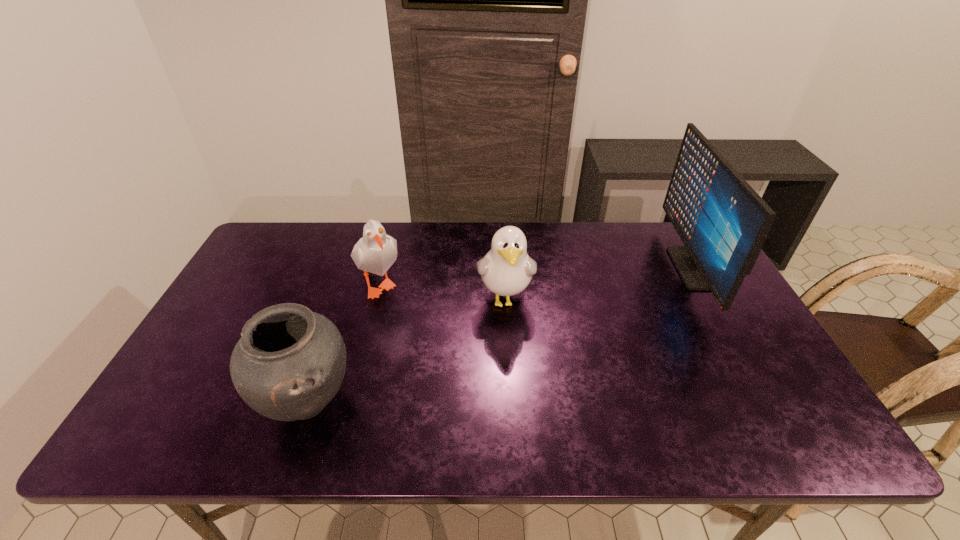
What are the coordinates of `blank space located 0.350m on the right of the urn` in the screenshot? It's located at click(509, 402).

Locate an element on the screen. The image size is (960, 540). computer monitor at the far edge is located at coordinates (722, 221).

Image resolution: width=960 pixels, height=540 pixels. Find the location of `gull located in the far edge section of the desktop`. gull located in the far edge section of the desktop is located at coordinates (375, 252).

At what (x,y) coordinates should I click in order to perform the action: click on object situated at the near edge. Please return your answer as a coordinate pair (x, y). This screenshot has width=960, height=540. Looking at the image, I should click on (290, 362).

This screenshot has height=540, width=960. In order to click on object that is at the right edge in this screenshot , I will do `click(722, 221)`.

Locate an element on the screen. Image resolution: width=960 pixels, height=540 pixels. object present at the far right corner is located at coordinates (722, 221).

This screenshot has height=540, width=960. In the image, there is a desktop. Find the location of `vacant region at the far edge`. vacant region at the far edge is located at coordinates (348, 261).

Locate an element on the screen. Image resolution: width=960 pixels, height=540 pixels. vacant space at the near edge of the desktop is located at coordinates (685, 423).

The image size is (960, 540). In order to click on vacant space at the left edge of the desktop in this screenshot , I will do `click(245, 287)`.

This screenshot has width=960, height=540. What are the coordinates of `vacant space at the far right corner of the desktop` in the screenshot? It's located at (680, 245).